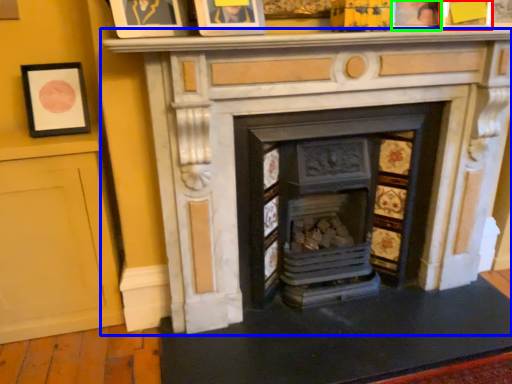
Question: Based on their relative distances, which object is nearer to picture frame (highlighted by a red box)? Choose from fireplace (highlighted by a blue box) and picture frame (highlighted by a green box).

Choices:
 (A) fireplace
 (B) picture frame

Answer: (B)